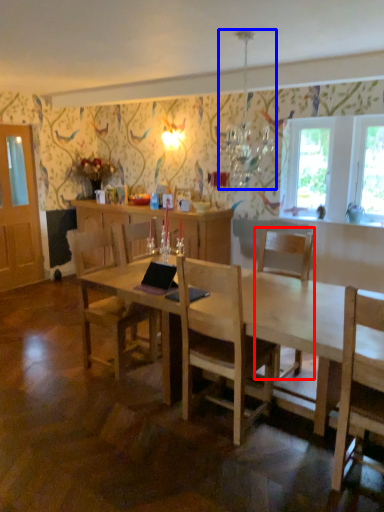
Question: Which of the following is the farthest to the observer, chair (highlighted by a red box) or lamp (highlighted by a blue box)?

Choices:
 (A) chair
 (B) lamp

Answer: (A)